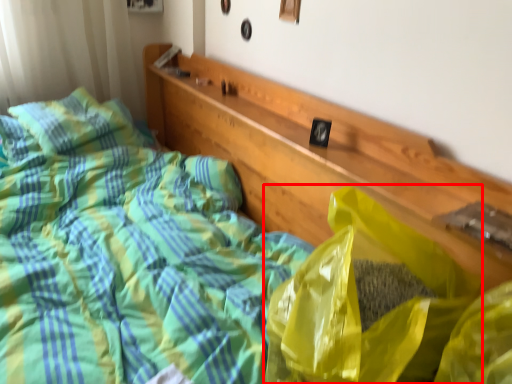
Question: From the image's perspective, considering the relative positions of plastic bag (annotated by the red box) and pillow in the image provided, where is plastic bag (annotated by the red box) located with respect to the staircase?

Choices:
 (A) above
 (B) below

Answer: (B)